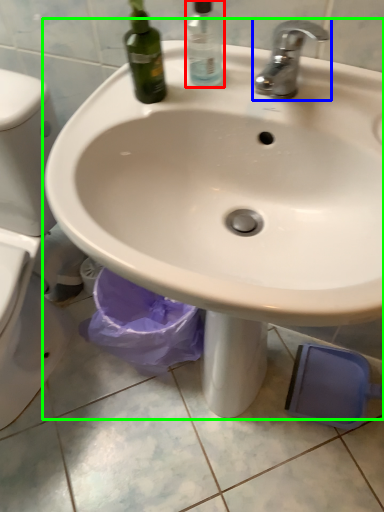
Question: Which object is the farthest from cleaning product (highlighted by a red box)? Choose among these: tap (highlighted by a blue box) or sink (highlighted by a green box).

Choices:
 (A) tap
 (B) sink

Answer: (B)